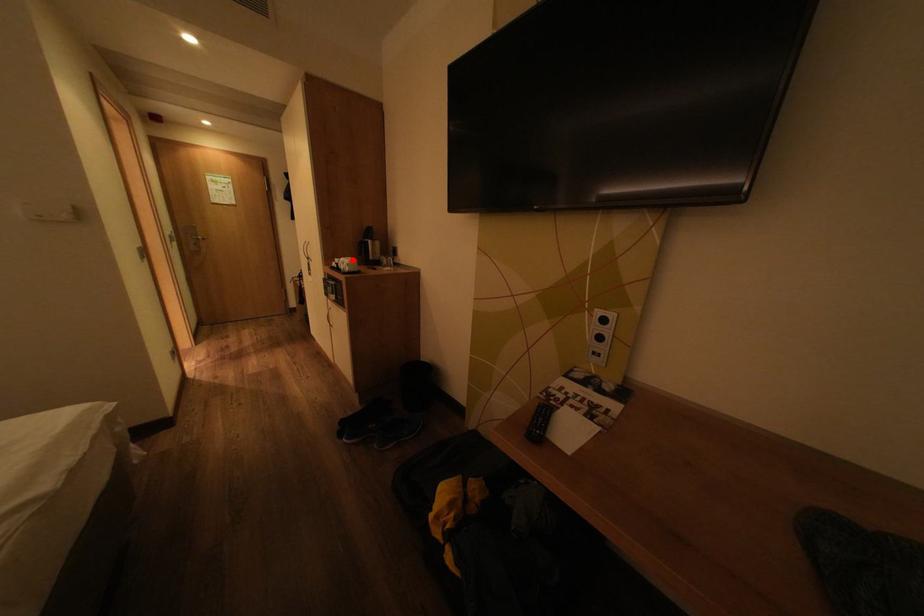
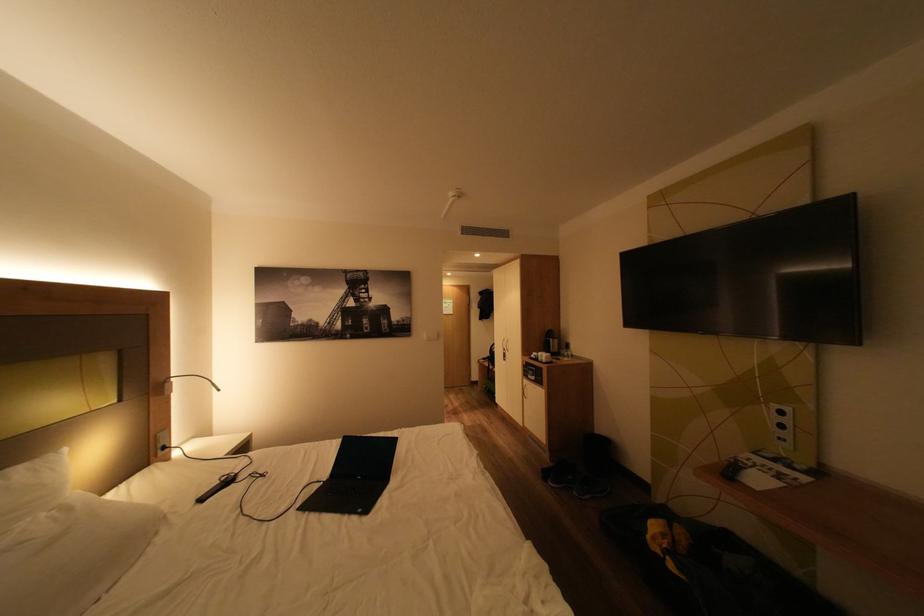
Where in the second image is the point corresponding to the highlighted location from the first image?

(551, 354)